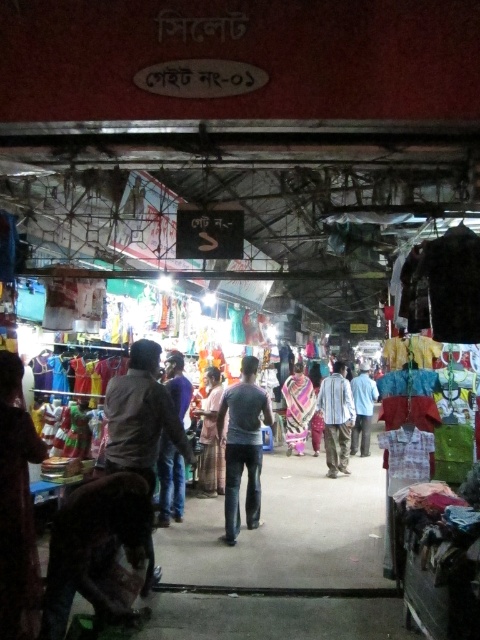
You are a customer in the market and want to buy both the purple cotton shirt at center and the brown cotton dress at center. You have a small shopping bag that can only hold items that take up less space than the other. Which item should you choose to fit in your bag first?

The purple cotton shirt at center occupies less space than the brown cotton dress at center, so you should choose the purple cotton shirt at center first to fit in your bag.

In the scene shown: You are a customer in the market and want to buy both the purple cotton shirt at center and the brown cotton dress at center. Which one is shorter in height?

The purple cotton shirt at center is not as tall as the brown cotton dress at center, so the purple cotton shirt at center is shorter in height.

You are standing in the middle of the market aisle and want to take a photo that includes both the point at coordinates point (157, 465) and point (215, 392). Since you need to focus on the closer object first, which point should you focus on first?

Point (157, 465) is closer to the camera than point (215, 392), so you should focus on point (157, 465) first.